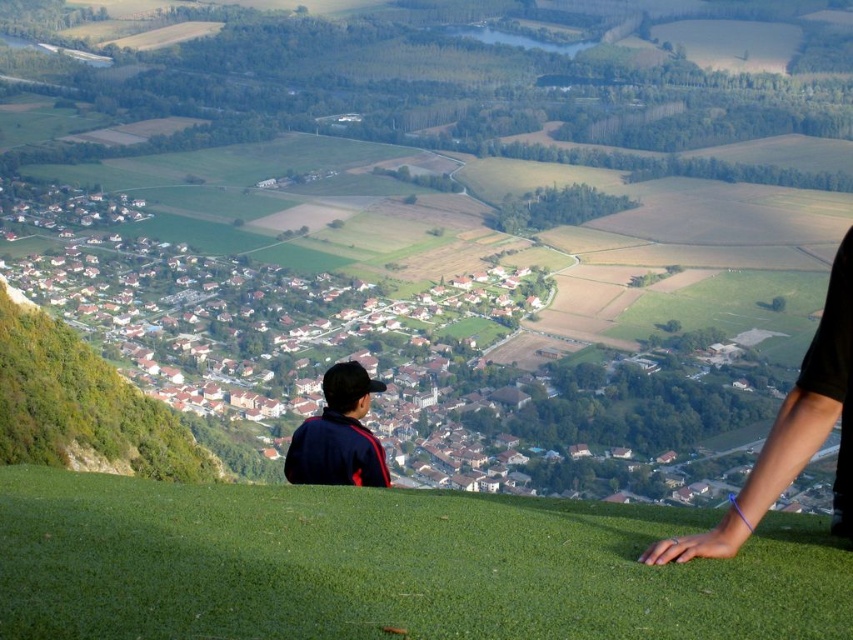
Question: Can you confirm if green grassy at lower center is smaller than dark blue jacket at center?

Choices:
 (A) no
 (B) yes

Answer: (B)

Question: Which object is farther from the camera taking this photo?

Choices:
 (A) green grassy at lower center
 (B) dark blue jacket at center

Answer: (B)

Question: Considering the relative positions of green grassy at lower center and dark blue jacket at center in the image provided, where is green grassy at lower center located with respect to dark blue jacket at center?

Choices:
 (A) left
 (B) right

Answer: (B)

Question: Which object is closer to the camera taking this photo?

Choices:
 (A) dark blue jacket at center
 (B) green grassy at lower center

Answer: (B)

Question: Considering the relative positions of green grassy at lower center and dark blue jacket at center in the image provided, where is green grassy at lower center located with respect to dark blue jacket at center?

Choices:
 (A) left
 (B) right

Answer: (B)